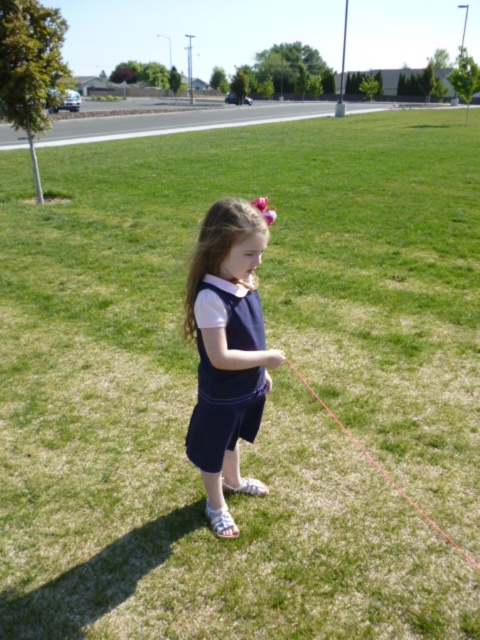
Question: Where is matte navy dress at center located in relation to navy matte dress at center in the image?

Choices:
 (A) right
 (B) left

Answer: (B)

Question: Can you confirm if matte navy dress at center is smaller than navy matte dress at center?

Choices:
 (A) no
 (B) yes

Answer: (A)

Question: Which of the following is the farthest from the observer?

Choices:
 (A) matte navy dress at center
 (B) navy matte dress at center

Answer: (B)

Question: Which of the following is the farthest from the observer?

Choices:
 (A) navy matte dress at center
 (B) matte navy dress at center

Answer: (A)

Question: Estimate the real-world distances between objects in this image. Which object is closer to the red string at lower center?

Choices:
 (A) matte navy dress at center
 (B) navy matte dress at center

Answer: (A)

Question: Does navy matte dress at center have a larger size compared to red string at lower center?

Choices:
 (A) no
 (B) yes

Answer: (A)